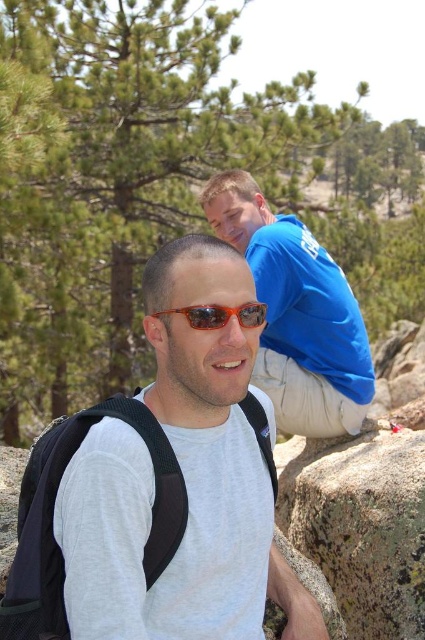
Can you confirm if blue cotton shirt at upper center is bigger than black mesh backpack at center?

Correct, blue cotton shirt at upper center is larger in size than black mesh backpack at center.

From the picture: Can you confirm if blue cotton shirt at upper center is positioned above black mesh backpack at center?

Correct, blue cotton shirt at upper center is located above black mesh backpack at center.

Describe the element at coordinates (297, 314) in the screenshot. This screenshot has height=640, width=425. I see `blue cotton shirt at upper center` at that location.

The width and height of the screenshot is (425, 640). Find the location of `blue cotton shirt at upper center`. blue cotton shirt at upper center is located at coordinates (297, 314).

Looking at this image, does black mesh backpack at center have a smaller size compared to orange reflective sunglasses at center?

No, black mesh backpack at center is not smaller than orange reflective sunglasses at center.

Which is below, black mesh backpack at center or orange reflective sunglasses at center?

black mesh backpack at center is below.

Find the location of a particular element. The image size is (425, 640). black mesh backpack at center is located at coordinates [x=53, y=516].

Can you confirm if green textured pine tree at upper center is thinner than gray matte t-shirt at center?

No.

You are a GUI agent. You are given a task and a screenshot of the screen. Output one action in this format:
    pyautogui.click(x=<x>, y=<y>)
    Task: Click on the green textured pine tree at upper center
    This screenshot has width=425, height=640.
    Given the screenshot: What is the action you would take?
    pyautogui.click(x=163, y=182)